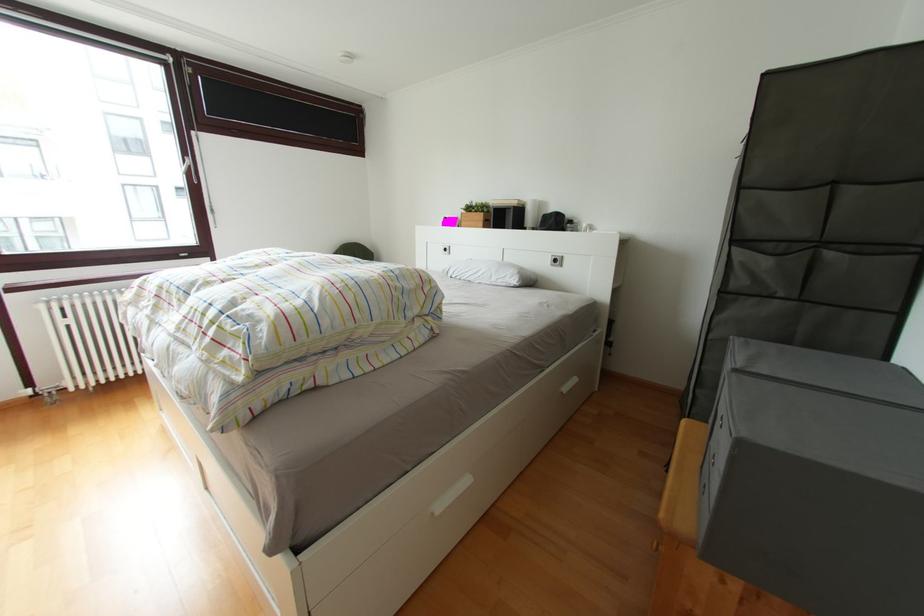
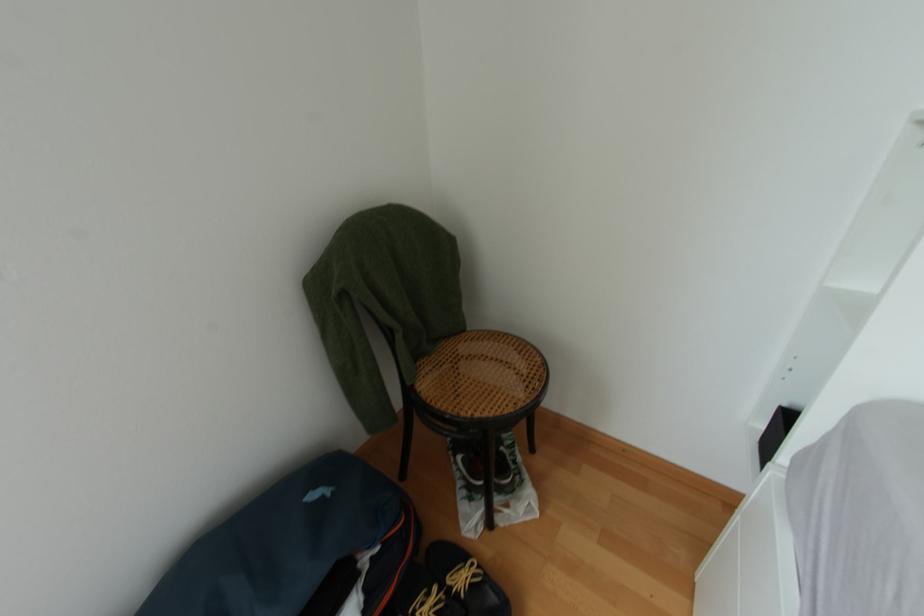
The images are taken continuously from a first-person perspective. In which direction are you moving?

The cameraman moved toward left, forward.